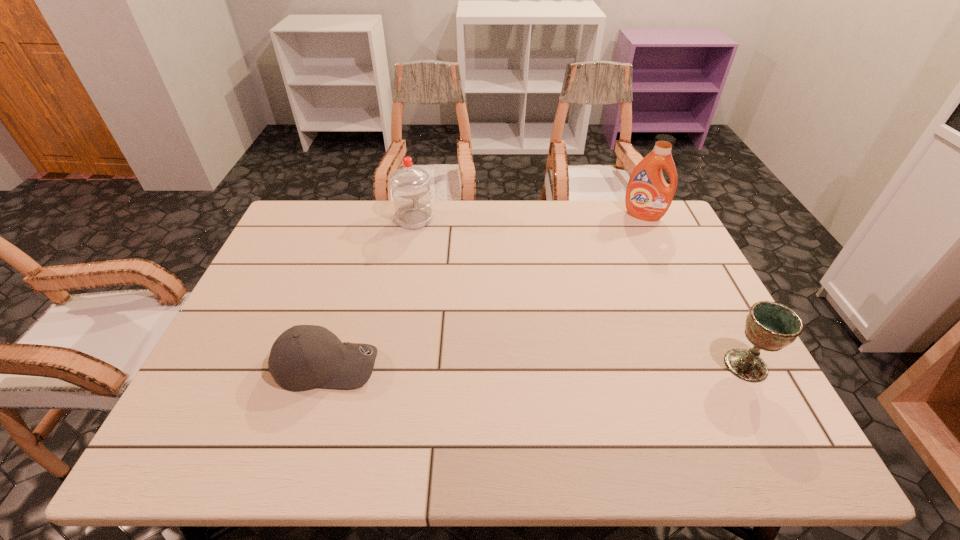
The width and height of the screenshot is (960, 540). I want to click on object situated at the far right corner, so click(648, 197).

Image resolution: width=960 pixels, height=540 pixels. I want to click on object positioned at the near right corner, so click(x=770, y=326).

You are a GUI agent. You are given a task and a screenshot of the screen. Output one action in this format:
    pyautogui.click(x=<x>, y=<y>)
    Task: Click on the vacant region at the far edge
    
    Given the screenshot: What is the action you would take?
    pyautogui.click(x=512, y=224)

Identify the location of vacant space at the near edge of the desktop. Image resolution: width=960 pixels, height=540 pixels. [x=468, y=393].

Identify the location of vacant space at the left edge. This screenshot has height=540, width=960. (225, 336).

Find the location of a particular element. This screenshot has width=960, height=540. free space at the right edge is located at coordinates (645, 259).

The width and height of the screenshot is (960, 540). What are the coordinates of `free space at the far left corner` in the screenshot? It's located at (317, 207).

This screenshot has width=960, height=540. In order to click on blank area at the far right corner in this screenshot , I will do `click(650, 230)`.

Identify the location of free space between the water bottle and the third tallest object. The height and width of the screenshot is (540, 960). (580, 292).

Where is `free space between the shortest object and the third tallest object`? The height and width of the screenshot is (540, 960). free space between the shortest object and the third tallest object is located at coordinates (536, 365).